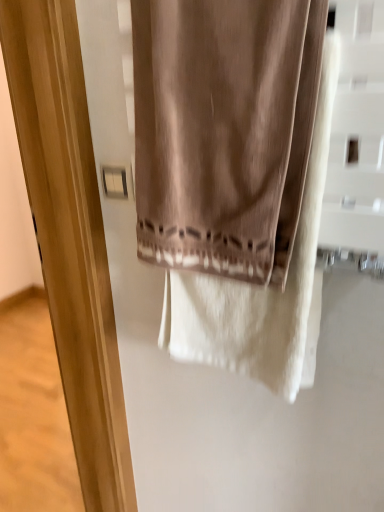
Question: From the image's perspective, is satin beige curtain at center beneath white plastic light switch at upper left?

Choices:
 (A) yes
 (B) no

Answer: (B)

Question: Is satin beige curtain at center to the left of white plastic light switch at upper left from the viewer's perspective?

Choices:
 (A) yes
 (B) no

Answer: (B)

Question: Can you confirm if satin beige curtain at center is wider than white plastic light switch at upper left?

Choices:
 (A) yes
 (B) no

Answer: (A)

Question: Can you confirm if satin beige curtain at center is thinner than white plastic light switch at upper left?

Choices:
 (A) yes
 (B) no

Answer: (B)

Question: Are satin beige curtain at center and white plastic light switch at upper left located far from each other?

Choices:
 (A) no
 (B) yes

Answer: (A)

Question: In terms of width, does matte wood screen door at center look wider or thinner when compared to white plastic light switch at upper left?

Choices:
 (A) thin
 (B) wide

Answer: (B)

Question: Considering the positions of matte wood screen door at center and white plastic light switch at upper left in the image, is matte wood screen door at center bigger or smaller than white plastic light switch at upper left?

Choices:
 (A) big
 (B) small

Answer: (A)

Question: Relative to white plastic light switch at upper left, is matte wood screen door at center in front or behind?

Choices:
 (A) behind
 (B) front

Answer: (B)

Question: In the image, is matte wood screen door at center on the left side or the right side of white plastic light switch at upper left?

Choices:
 (A) left
 (B) right

Answer: (A)

Question: Is satin beige curtain at center taller or shorter than matte wood screen door at center?

Choices:
 (A) short
 (B) tall

Answer: (A)

Question: From a real-world perspective, is satin beige curtain at center physically located above or below matte wood screen door at center?

Choices:
 (A) above
 (B) below

Answer: (A)

Question: Do you think satin beige curtain at center is within matte wood screen door at center, or outside of it?

Choices:
 (A) inside
 (B) outside

Answer: (B)

Question: Considering the relative positions of satin beige curtain at center and matte wood screen door at center in the image provided, is satin beige curtain at center to the left or to the right of matte wood screen door at center?

Choices:
 (A) left
 (B) right

Answer: (B)

Question: Considering the relative positions of satin beige curtain at center and white plastic light switch at upper left in the image provided, is satin beige curtain at center to the left or to the right of white plastic light switch at upper left?

Choices:
 (A) right
 (B) left

Answer: (A)

Question: From their relative heights in the image, would you say satin beige curtain at center is taller or shorter than white plastic light switch at upper left?

Choices:
 (A) tall
 (B) short

Answer: (A)